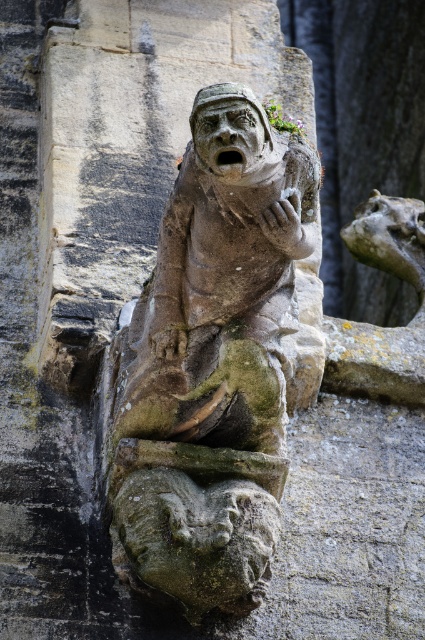
Can you confirm if stone gargoyle at center is positioned to the left of matte stone face at center?

Indeed, stone gargoyle at center is positioned on the left side of matte stone face at center.

Which of these two, stone gargoyle at center or matte stone face at center, stands taller?

With more height is stone gargoyle at center.

Does point (200, 320) come behind point (235, 145)?

Yes, point (200, 320) is farther from viewer.

You are a GUI agent. You are given a task and a screenshot of the screen. Output one action in this format:
    pyautogui.click(x=<x>, y=<y>)
    Task: Click on the stone gargoyle at center
    The image size is (425, 640).
    Given the screenshot: What is the action you would take?
    pyautogui.click(x=209, y=380)